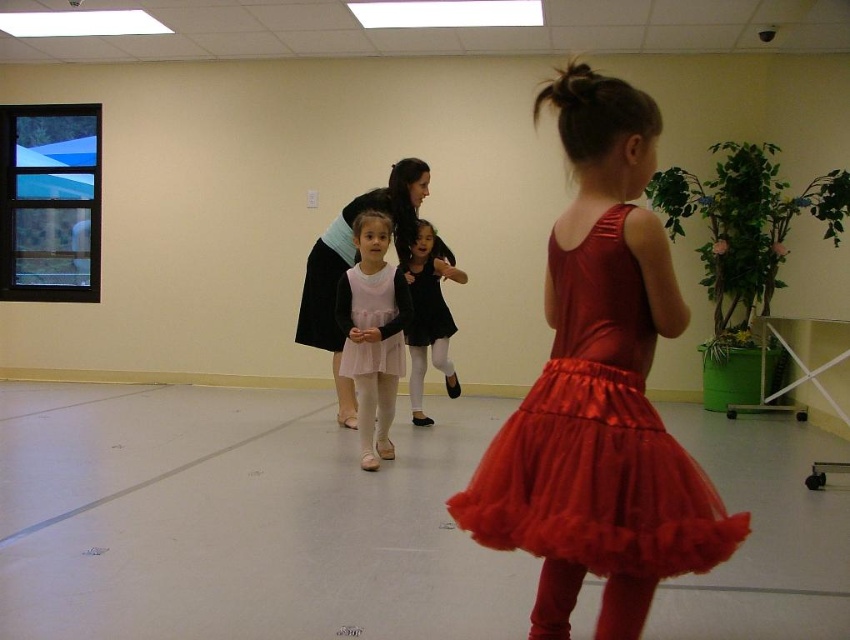
In the dance studio scene, you notice two outfits at center stage. The shiny red tulle skirt at center and the pink satin dress at center. Which of these two outfits is narrower in width?

The shiny red tulle skirt at center is thinner than the pink satin dress at center, so the shiny red tulle skirt at center is narrower in width.

Based on the scene description, where is the pink satin dress at center located in terms of coordinates?

The pink satin dress at center is located at coordinates point (352, 264).

In the dance studio scene, there are two girls wearing different outfits. One has a shiny red tulle skirt at center and the other has a pink satin dress at center. Which outfit is smaller in size?

The shiny red tulle skirt at center is smaller than the pink satin dress at center.